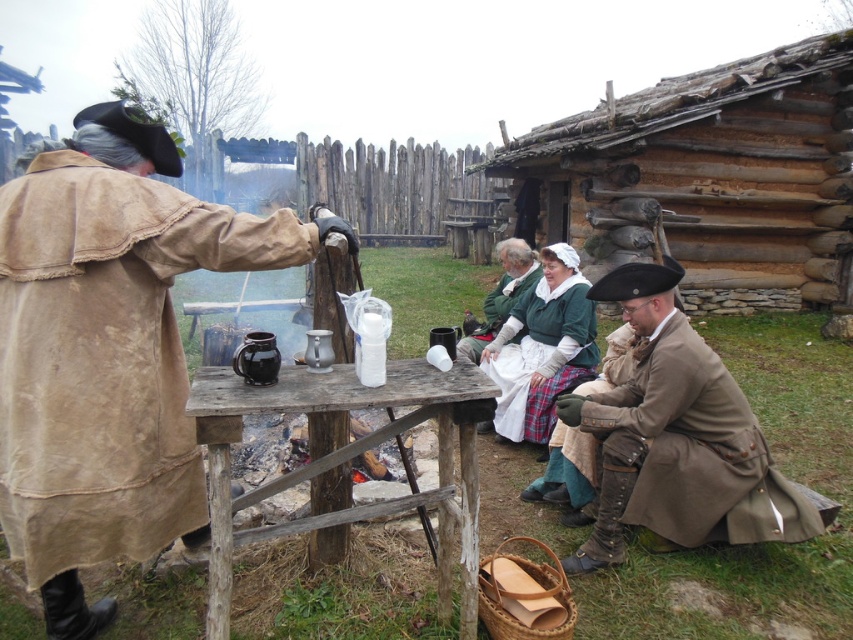
Between point (688, 324) and point (543, 291), which one is positioned behind?

Point (543, 291)

Does brown leather robe at lower right lie behind white cotton apron at center?

No, it is not.

What do you see at coordinates (686, 452) in the screenshot? The width and height of the screenshot is (853, 640). I see `brown leather robe at lower right` at bounding box center [686, 452].

Locate an element on the screen. The height and width of the screenshot is (640, 853). brown leather robe at lower right is located at coordinates (686, 452).

Between wooden table at center and green woolen robe at center, which one has more height?

With more height is wooden table at center.

Is wooden table at center taller than green woolen robe at center?

Indeed, wooden table at center has a greater height compared to green woolen robe at center.

The width and height of the screenshot is (853, 640). In order to click on wooden table at center in this screenshot , I will do `click(346, 461)`.

Based on the photo, can you confirm if brown leather robe at lower right is positioned above wooden table at center?

Actually, brown leather robe at lower right is below wooden table at center.

Can you confirm if brown leather robe at lower right is bigger than wooden table at center?

No, brown leather robe at lower right is not bigger than wooden table at center.

Which is in front, point (782, 532) or point (222, 616)?

Positioned in front is point (222, 616).

This screenshot has width=853, height=640. Find the location of `brown leather robe at lower right`. brown leather robe at lower right is located at coordinates (686, 452).